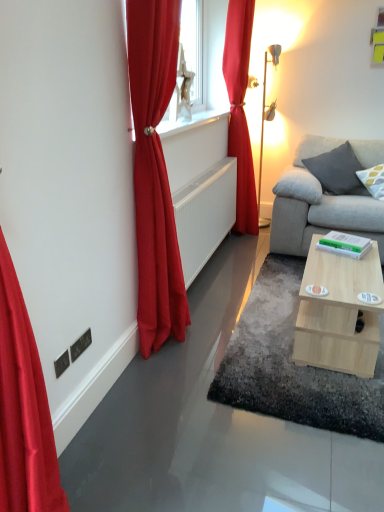
Question: Is gray fabric pillow at right, the 2th pillow from the left, surrounding satin red curtain at upper right, the 1th curtain from the right?

Choices:
 (A) no
 (B) yes

Answer: (A)

Question: Is gray fabric pillow at right, positioned as the first pillow in right-to-left order, in front of satin red curtain at upper right, the second curtain when ordered from left to right?

Choices:
 (A) yes
 (B) no

Answer: (B)

Question: Is gray fabric pillow at right, positioned as the first pillow in right-to-left order, located outside satin red curtain at upper right, which is counted as the 1th curtain, starting from the back?

Choices:
 (A) yes
 (B) no

Answer: (A)

Question: Is gray fabric pillow at right, the 2th pillow from the left, oriented towards satin red curtain at upper right, the 1th curtain from the right?

Choices:
 (A) yes
 (B) no

Answer: (B)

Question: From the image's perspective, would you say gray fabric pillow at right, the 2th pillow from the left, is positioned over satin red curtain at upper right, the second curtain when ordered from left to right?

Choices:
 (A) no
 (B) yes

Answer: (A)

Question: Is gray fabric pillow at right, positioned as the first pillow in right-to-left order, oriented away from satin red curtain at upper right, the 1th curtain from the right?

Choices:
 (A) yes
 (B) no

Answer: (B)

Question: Can we say gray fabric pillow at right, the first pillow in the left-to-right sequence, lies outside satin red curtain at left, which appears as the first curtain when viewed from the left?

Choices:
 (A) no
 (B) yes

Answer: (B)

Question: Are gray fabric pillow at right, the first pillow in the left-to-right sequence, and satin red curtain at left, which ranks as the second curtain in back-to-front order, beside each other?

Choices:
 (A) no
 (B) yes

Answer: (A)

Question: Does gray fabric pillow at right, placed as the second pillow when sorted from right to left, turn towards satin red curtain at left, positioned as the second curtain in right-to-left order?

Choices:
 (A) no
 (B) yes

Answer: (B)

Question: Does gray fabric pillow at right, placed as the second pillow when sorted from right to left, come in front of satin red curtain at left, which appears as the first curtain when viewed from the left?

Choices:
 (A) yes
 (B) no

Answer: (B)

Question: Is satin red curtain at left, positioned as the second curtain in right-to-left order, surrounded by gray fabric pillow at right, placed as the second pillow when sorted from right to left?

Choices:
 (A) yes
 (B) no

Answer: (B)

Question: Considering the relative sizes of gray fabric pillow at right, placed as the second pillow when sorted from right to left, and satin red curtain at left, positioned as the 1th curtain in front-to-back order, in the image provided, is gray fabric pillow at right, placed as the second pillow when sorted from right to left, bigger than satin red curtain at left, positioned as the 1th curtain in front-to-back order,?

Choices:
 (A) yes
 (B) no

Answer: (B)

Question: From the image's perspective, is gray fabric pillow at right, positioned as the first pillow in right-to-left order, on satin red curtain at left, which ranks as the second curtain in back-to-front order?

Choices:
 (A) no
 (B) yes

Answer: (B)